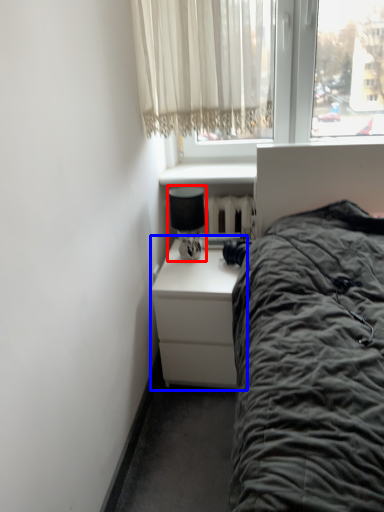
Question: Which of the following is the closest to the observer, lamp (highlighted by a red box) or nightstand (highlighted by a blue box)?

Choices:
 (A) lamp
 (B) nightstand

Answer: (B)